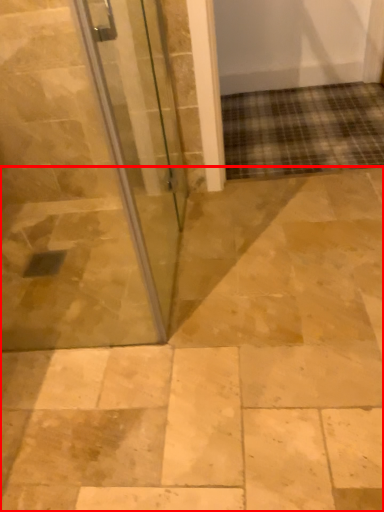
Question: From the image's perspective, what is the correct spatial relationship of path (annotated by the red box) in relation to door?

Choices:
 (A) below
 (B) above

Answer: (A)